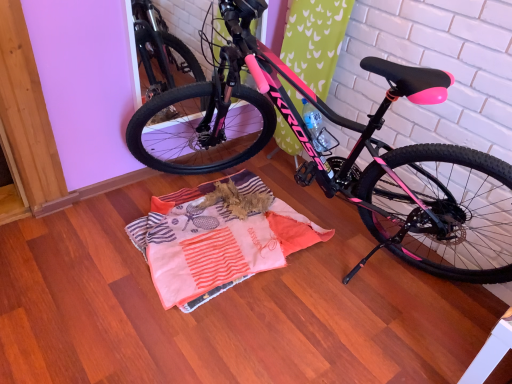
Image resolution: width=512 pixels, height=384 pixels. Find the location of `free space between pink matte bicycle at center and striped cotton blanket at center`. free space between pink matte bicycle at center and striped cotton blanket at center is located at coordinates (202, 317).